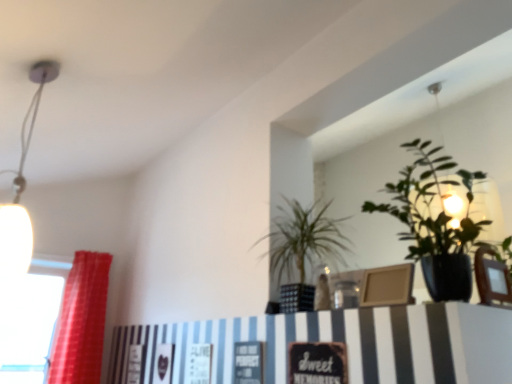
Question: Is green glossy plant at upper right, which ranks as the first houseplant in right-to-left order, further to the viewer compared to red fabric curtain at left?

Choices:
 (A) no
 (B) yes

Answer: (A)

Question: Can you confirm if green glossy plant at upper right, arranged as the 2th houseplant when viewed from the left, is positioned to the left of red fabric curtain at left?

Choices:
 (A) yes
 (B) no

Answer: (B)

Question: Can you confirm if green glossy plant at upper right, arranged as the 2th houseplant when viewed from the left, is taller than red fabric curtain at left?

Choices:
 (A) no
 (B) yes

Answer: (A)

Question: Considering the relative sizes of green glossy plant at upper right, which ranks as the first houseplant in right-to-left order, and red fabric curtain at left in the image provided, is green glossy plant at upper right, which ranks as the first houseplant in right-to-left order, wider than red fabric curtain at left?

Choices:
 (A) no
 (B) yes

Answer: (B)

Question: From the image's perspective, is green glossy plant at upper right, arranged as the 2th houseplant when viewed from the left, on red fabric curtain at left?

Choices:
 (A) no
 (B) yes

Answer: (B)

Question: From a real-world perspective, is green glossy plant at upper right, which ranks as the first houseplant in right-to-left order, over red fabric curtain at left?

Choices:
 (A) no
 (B) yes

Answer: (B)

Question: Is transparent glass window at left wider than white glossy lamp at upper left?

Choices:
 (A) yes
 (B) no

Answer: (A)

Question: From the image's perspective, is transparent glass window at left over white glossy lamp at upper left?

Choices:
 (A) yes
 (B) no

Answer: (B)

Question: Is transparent glass window at left facing towards white glossy lamp at upper left?

Choices:
 (A) yes
 (B) no

Answer: (A)

Question: From a real-world perspective, is transparent glass window at left physically above white glossy lamp at upper left?

Choices:
 (A) yes
 (B) no

Answer: (B)

Question: Does transparent glass window at left have a lesser height compared to white glossy lamp at upper left?

Choices:
 (A) no
 (B) yes

Answer: (B)

Question: From a real-world perspective, is transparent glass window at left located beneath white glossy lamp at upper left?

Choices:
 (A) yes
 (B) no

Answer: (A)

Question: Considering the relative positions of green leafy plant at center, the first houseplant from the left, and red fabric curtain at left in the image provided, is green leafy plant at center, the first houseplant from the left, in front of red fabric curtain at left?

Choices:
 (A) yes
 (B) no

Answer: (A)